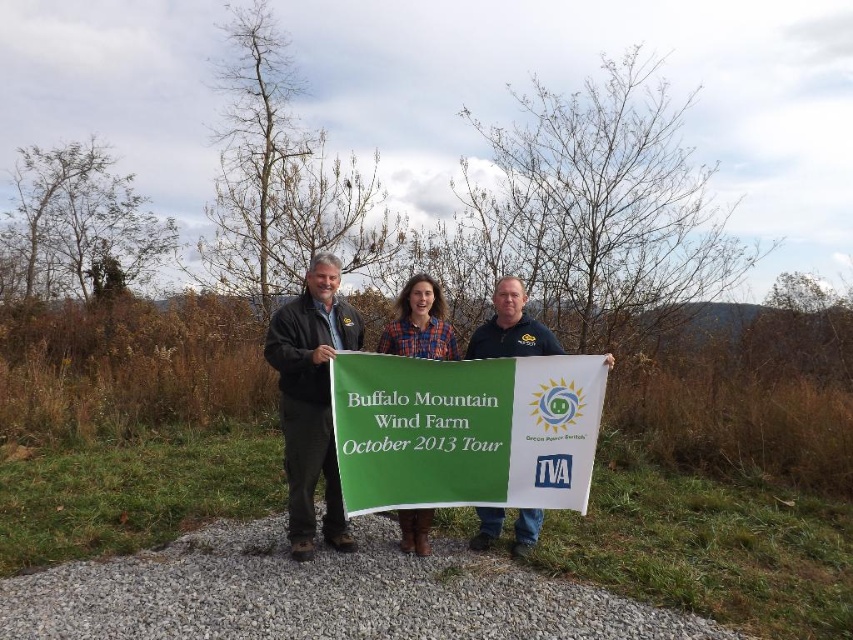
You are a photographer trying to capture a group photo of the dark brown leather jacket at center and the dark blue shirt at center. Which person should you focus on first if you want to ensure their full height is in the frame?

You should focus on the dark brown leather jacket at center first because it has a greater height compared to the dark blue shirt at center, so ensuring its full height is captured will automatically include the shorter individual in the frame.